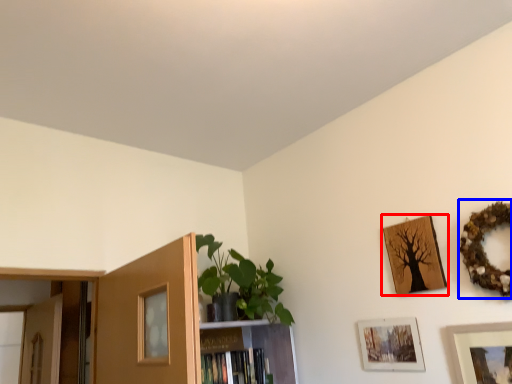
Question: Which of the following is the closest to the observer, picture frame (highlighted by a red box) or picture frame (highlighted by a blue box)?

Choices:
 (A) picture frame
 (B) picture frame

Answer: (B)